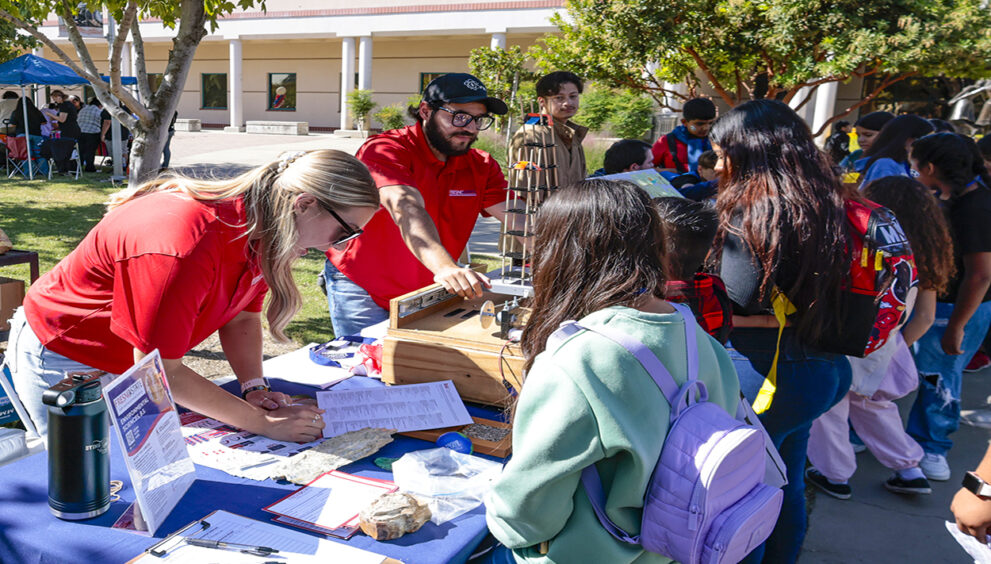
Find the location of a particular element. Image resolution: width=991 pixels, height=564 pixels. window is located at coordinates (212, 95).